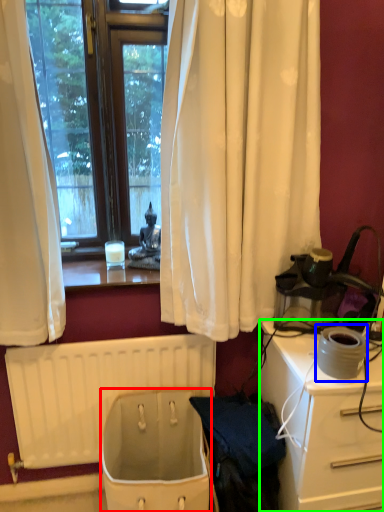
Question: Which object is the closest to the toilet bowl (highlighted by a red box)? Choose among these: appliance (highlighted by a blue box) or desk (highlighted by a green box).

Choices:
 (A) appliance
 (B) desk

Answer: (B)